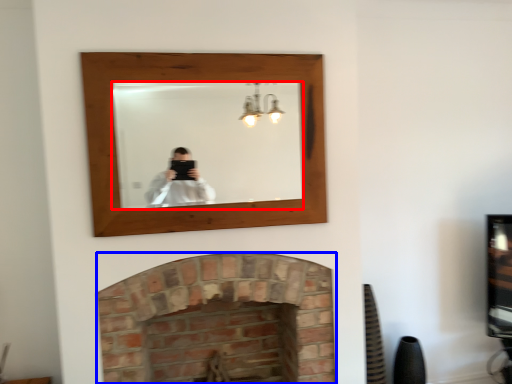
Question: Which point is closer to the camera, mirror (highlighted by a red box) or fireplace (highlighted by a blue box)?

Choices:
 (A) mirror
 (B) fireplace

Answer: (A)